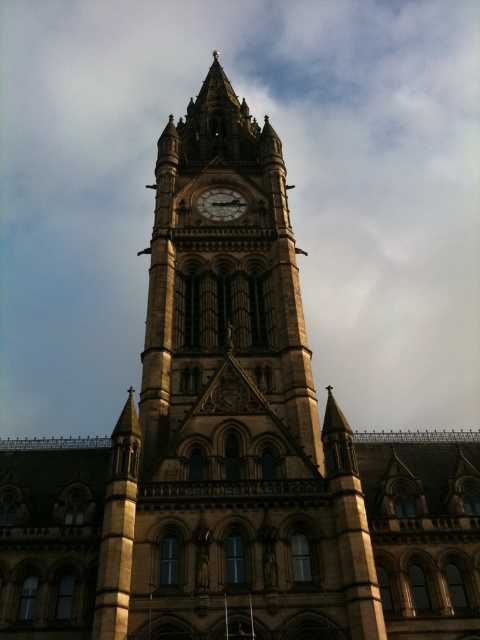
Question: Where is golden stone clock tower at center located in relation to dark brown wooden clock at center in the image?

Choices:
 (A) below
 (B) above

Answer: (B)

Question: Which point is closer to the camera?

Choices:
 (A) dark brown wooden clock at center
 (B) golden stone clock tower at center

Answer: (B)

Question: Among these points, which one is farthest from the camera?

Choices:
 (A) (199, 202)
 (B) (216, 339)

Answer: (A)

Question: In this image, where is golden stone clock tower at center located relative to dark brown wooden clock at center?

Choices:
 (A) left
 (B) right

Answer: (A)

Question: Which point is closer to the camera?

Choices:
 (A) dark brown wooden clock at center
 (B) golden stone clock tower at center

Answer: (B)

Question: Is golden stone clock tower at center wider than dark brown wooden clock at center?

Choices:
 (A) yes
 (B) no

Answer: (A)